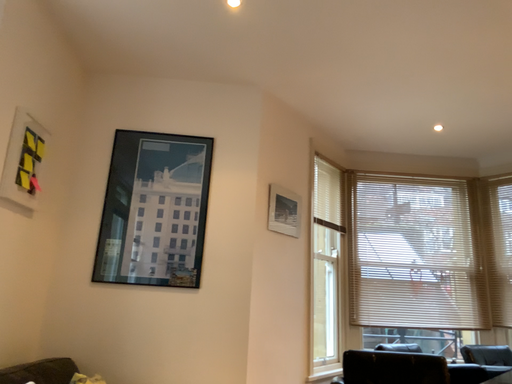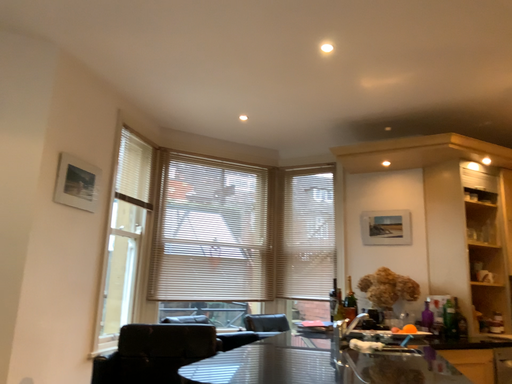
Question: Which way did the camera rotate in the video?

Choices:
 (A) rotated right
 (B) rotated left

Answer: (A)